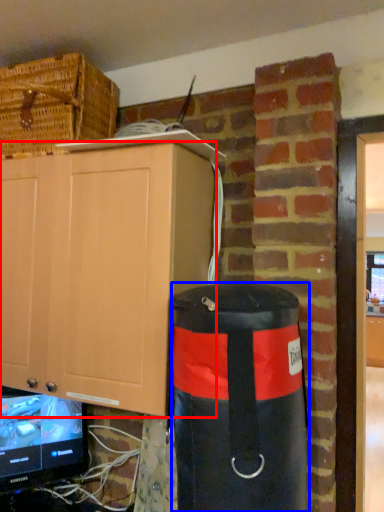
Question: Among these objects, which one is farthest to the camera, cabinetry (highlighted by a red box) or punching bag (highlighted by a blue box)?

Choices:
 (A) cabinetry
 (B) punching bag

Answer: (A)